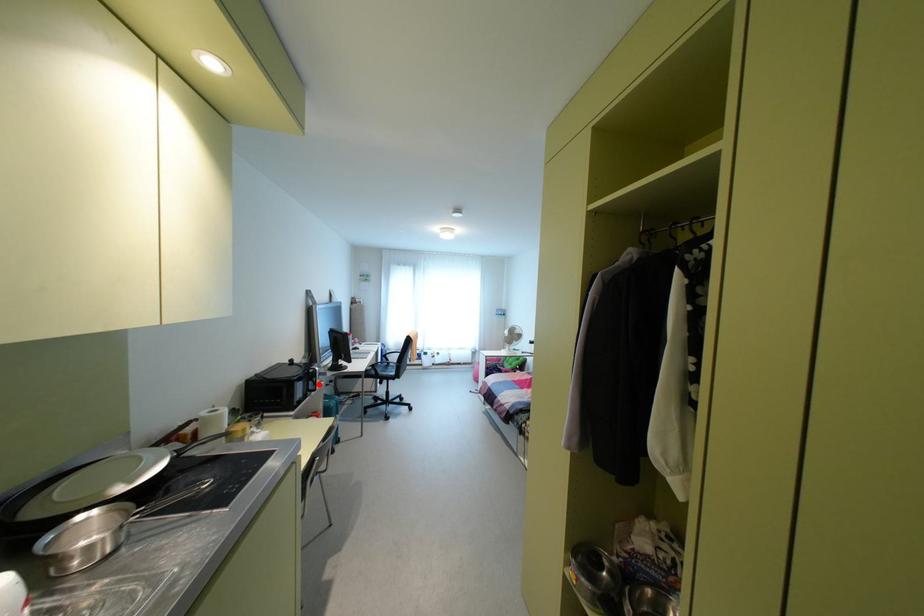
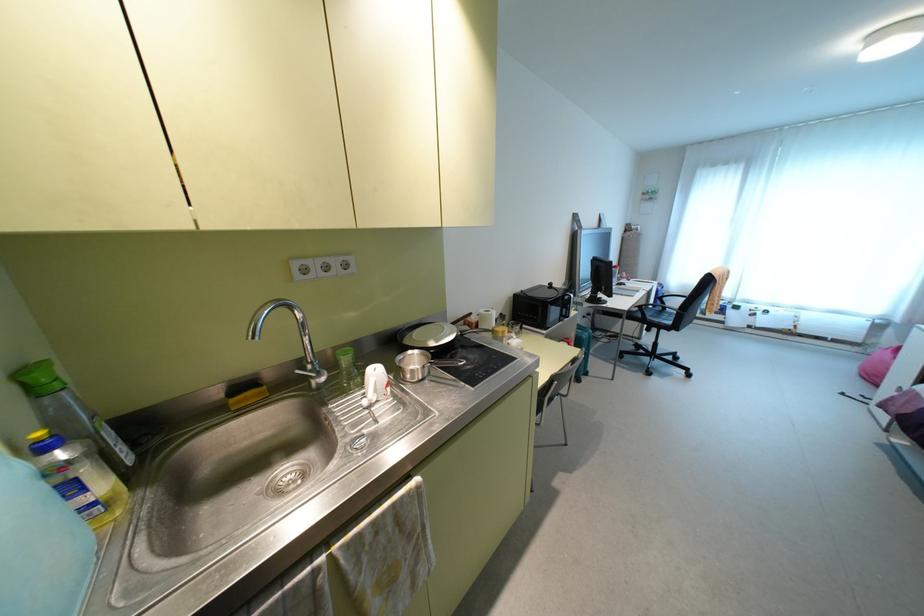
In the second image, find the point that corresponds to the highlighted location in the first image.

(573, 313)